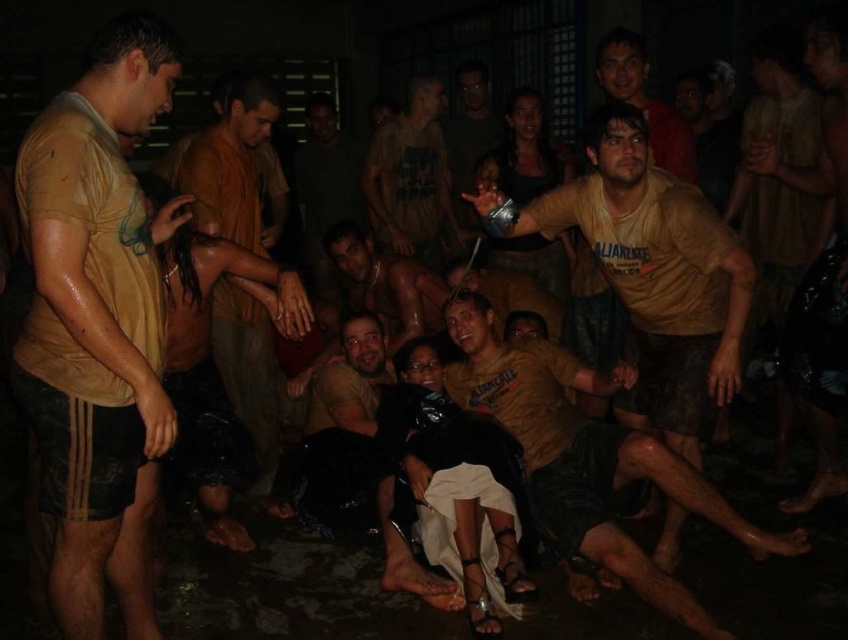
Can you confirm if matte brown shirt at left is smaller than brown cotton shirt at center?

Indeed, matte brown shirt at left has a smaller size compared to brown cotton shirt at center.

Does matte brown shirt at left have a greater height compared to brown cotton shirt at center?

Yes, matte brown shirt at left is taller than brown cotton shirt at center.

This screenshot has width=848, height=640. I want to click on matte brown shirt at left, so click(x=98, y=324).

Between brown leather jacket at center and matte yellow shirt at center, which one appears on the left side from the viewer's perspective?

brown leather jacket at center

Does brown leather jacket at center have a lesser width compared to matte yellow shirt at center?

In fact, brown leather jacket at center might be wider than matte yellow shirt at center.

Find the location of a particular element. The image size is (848, 640). brown leather jacket at center is located at coordinates pos(386,284).

Between brown matte shirt at center and matte yellow shirt at center, which one is positioned higher?

matte yellow shirt at center

Who is positioned more to the left, brown matte shirt at center or matte yellow shirt at center?

brown matte shirt at center

Who is more distant from viewer, [255,147] or [676,172]?

Positioned behind is point [255,147].

Image resolution: width=848 pixels, height=640 pixels. I want to click on brown matte shirt at center, so click(233, 161).